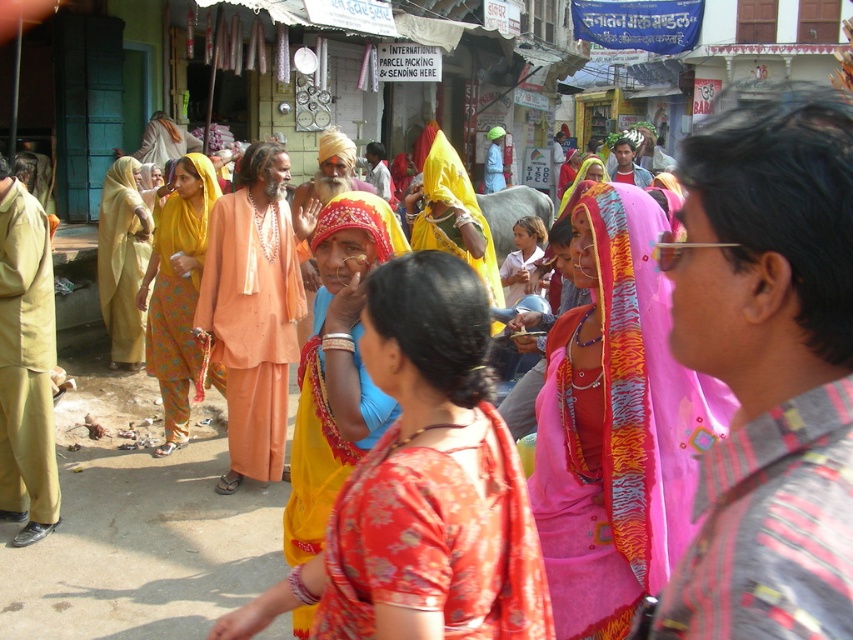
You are a tailor standing 36 inches away from a sewing machine. You want to reach the pink fabric at center to cut it. Can you comfortably reach it without moving your position?

The pink fabric at center is 38.51 inches away from the viewer. Since you are 36 inches away from the sewing machine, the distance between you and the pink fabric at center is 38.51 inches minus 36 inches, which equals 2.51 inches. Therefore, you can comfortably reach the pink fabric at center without moving.

Please look at the image. There is a point marked at coordinates [770,529]. What object or feature does this point correspond to in the scene?

The point at coordinates [770,529] corresponds to the pink fabric at center.